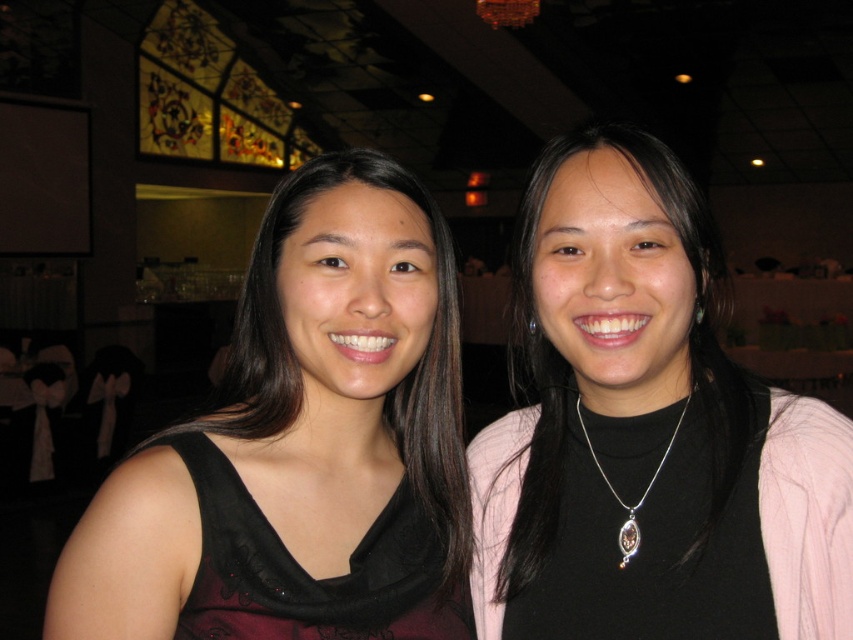
Who is higher up, black matte necklace at center or black matte dress at left?

black matte necklace at center is above.

The image size is (853, 640). I want to click on black matte necklace at center, so click(648, 432).

Is point (264, 401) closer to camera compared to point (637, 545)?

That is False.

Is black matte dress at left closer to the viewer compared to silver/glass pendant at center?

Yes, black matte dress at left is in front of silver/glass pendant at center.

Does point (271, 273) lie in front of point (654, 480)?

Yes, point (271, 273) is in front of point (654, 480).

The width and height of the screenshot is (853, 640). Find the location of `black matte dress at left`. black matte dress at left is located at coordinates (302, 444).

Is black matte necklace at center below silver/glass pendant at center?

No, black matte necklace at center is not below silver/glass pendant at center.

Is black matte necklace at center thinner than silver/glass pendant at center?

In fact, black matte necklace at center might be wider than silver/glass pendant at center.

You are a GUI agent. You are given a task and a screenshot of the screen. Output one action in this format:
    pyautogui.click(x=<x>, y=<y>)
    Task: Click on the black matte necklace at center
    
    Given the screenshot: What is the action you would take?
    pyautogui.click(x=648, y=432)